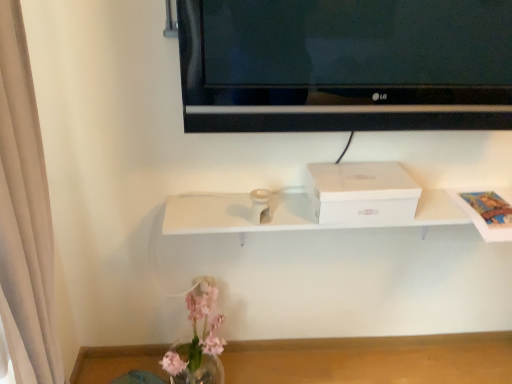
Where is `vacant area situated below white cardboard box at center (from a real-world perspective)`? This screenshot has width=512, height=384. vacant area situated below white cardboard box at center (from a real-world perspective) is located at coordinates (330, 365).